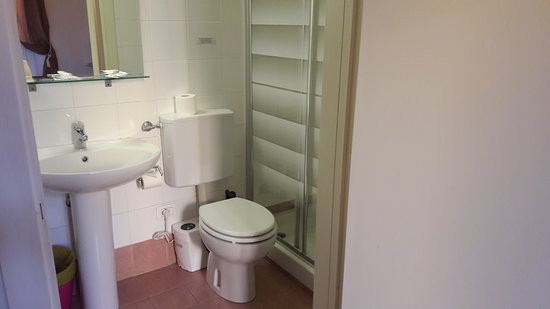
Locate an element on the screen. The image size is (550, 309). wall is located at coordinates (384, 189).